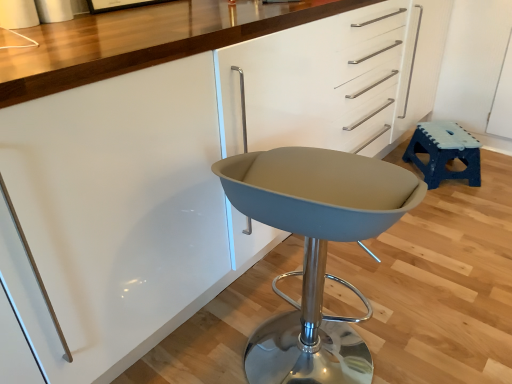
At what (x,y) coordinates should I click in order to perform the action: click on vacant area that is situated to the right of blue plastic stool at right. Please return your answer as a coordinate pair (x, y). This screenshot has height=384, width=512. Looking at the image, I should click on (495, 177).